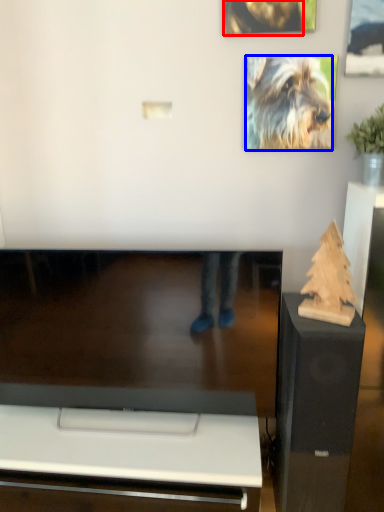
Question: Which point is further to the camera, dog (highlighted by a red box) or dog (highlighted by a blue box)?

Choices:
 (A) dog
 (B) dog

Answer: (B)